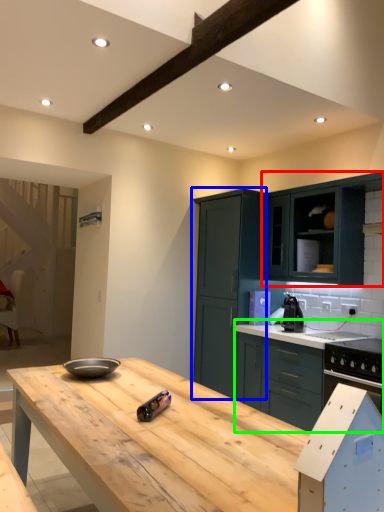
Question: Which is farther away from cabinetry (highlighted by a red box)? cabinetry (highlighted by a blue box) or cabinetry (highlighted by a green box)?

Choices:
 (A) cabinetry
 (B) cabinetry

Answer: (B)